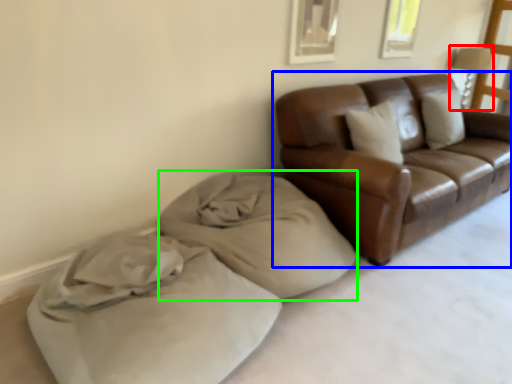
Question: Considering the real-world distances, which object is farthest from lamp (highlighted by a red box)? studio couch (highlighted by a blue box) or material (highlighted by a green box)?

Choices:
 (A) studio couch
 (B) material

Answer: (B)